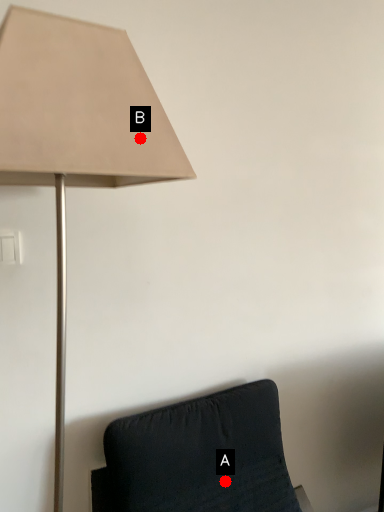
Question: Two points are circled on the image, labeled by A and B beside each circle. Which of the following is the farthest from the observer?

Choices:
 (A) A is further
 (B) B is further

Answer: (A)